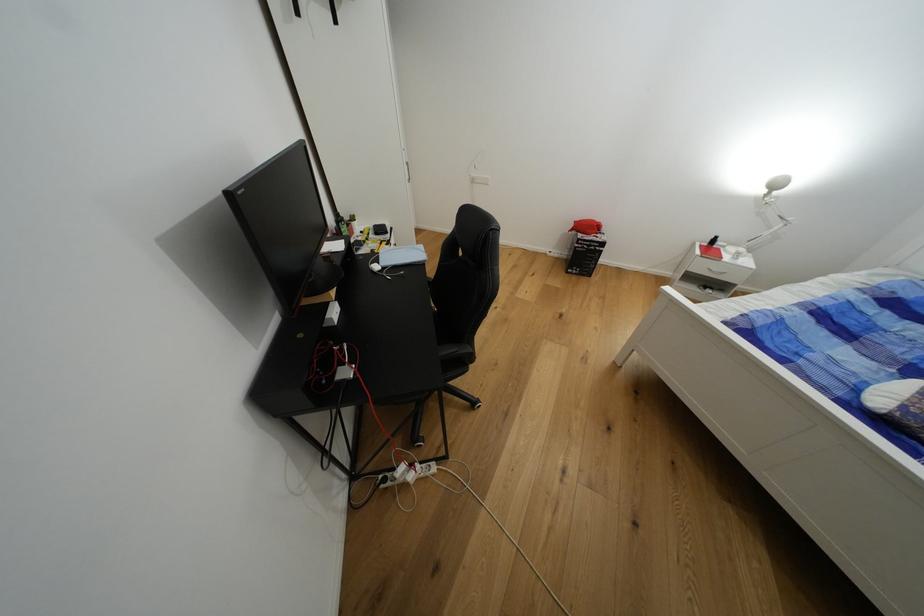
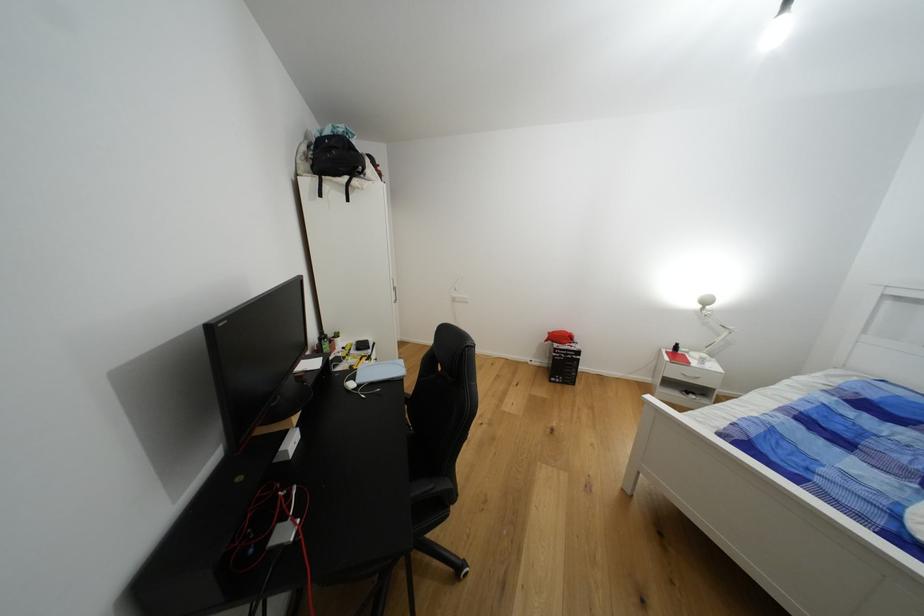
Question: The images are taken continuously from a first-person perspective. In which direction is your viewpoint rotating?

Choices:
 (A) Left
 (B) Right
 (C) Up
 (D) Down

Answer: (C)